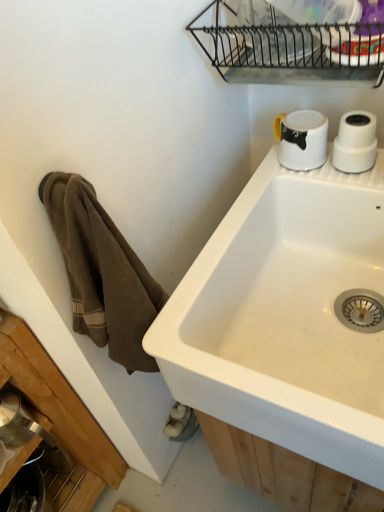
Question: Is metallic wire rack at upper center in front of white ceramic sink at upper right?

Choices:
 (A) no
 (B) yes

Answer: (A)

Question: From a real-world perspective, is metallic wire rack at upper center located higher than white ceramic sink at upper right?

Choices:
 (A) yes
 (B) no

Answer: (A)

Question: Is white ceramic sink at upper right surrounded by metallic wire rack at upper center?

Choices:
 (A) yes
 (B) no

Answer: (B)

Question: Could you tell me if metallic wire rack at upper center is facing white ceramic sink at upper right?

Choices:
 (A) no
 (B) yes

Answer: (A)

Question: Is metallic wire rack at upper center looking in the opposite direction of white ceramic sink at upper right?

Choices:
 (A) yes
 (B) no

Answer: (B)

Question: Considering their positions, is white glossy mug at upper right located in front of or behind white ceramic sink at upper right?

Choices:
 (A) behind
 (B) front

Answer: (A)

Question: From a real-world perspective, is white glossy mug at upper right positioned above or below white ceramic sink at upper right?

Choices:
 (A) above
 (B) below

Answer: (A)

Question: Would you say white glossy mug at upper right is to the left or to the right of white ceramic sink at upper right in the picture?

Choices:
 (A) right
 (B) left

Answer: (B)

Question: Is white glossy mug at upper right bigger or smaller than white ceramic sink at upper right?

Choices:
 (A) big
 (B) small

Answer: (B)

Question: From a real-world perspective, is white glossy mug at upper right positioned above or below metallic wire rack at upper center?

Choices:
 (A) above
 (B) below

Answer: (B)

Question: Is point (288, 137) positioned closer to the camera than point (365, 5)?

Choices:
 (A) farther
 (B) closer

Answer: (A)

Question: In the image, is white glossy mug at upper right positioned in front of or behind metallic wire rack at upper center?

Choices:
 (A) front
 (B) behind

Answer: (B)

Question: Considering the positions of white glossy mug at upper right and metallic wire rack at upper center in the image, is white glossy mug at upper right bigger or smaller than metallic wire rack at upper center?

Choices:
 (A) small
 (B) big

Answer: (A)

Question: Is metallic wire rack at upper center inside or outside of white glossy mug at upper right?

Choices:
 (A) inside
 (B) outside

Answer: (B)

Question: Is metallic wire rack at upper center bigger or smaller than white glossy mug at upper right?

Choices:
 (A) small
 (B) big

Answer: (B)